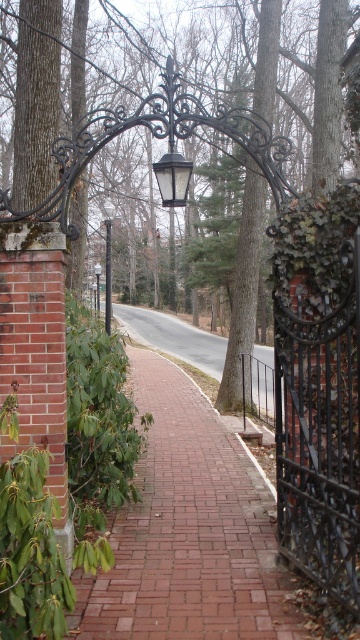
Consider the image. You are a landscape architect designing a new garden. You need to place a new bench between the green leafy tree at center and the black wrought iron lamp post at center. Which object should the bench be closer to to ensure it is within the garden pathway?

The bench should be closer to the black wrought iron lamp post at center because the green leafy tree at center might be wider than the black wrought iron lamp post at center, so placing the bench closer to the lamp post ensures it stays within the pathway.

You are a gardener planning to trim the green glossy ivy at left and the black metal lamp post at center. Which object is closer to you from your current position in the scene?

The green glossy ivy at left is closer to you because it is in front of the black metal lamp post at center.